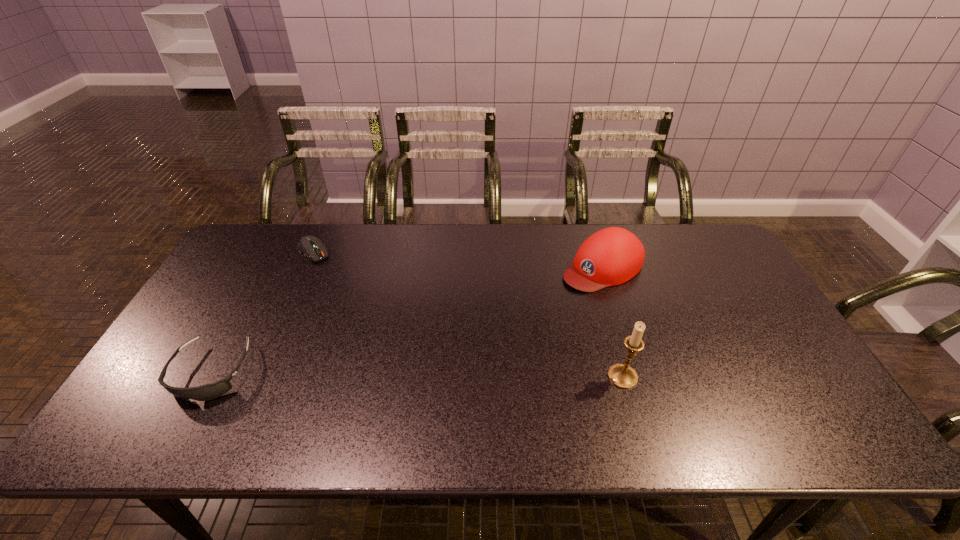
Identify the location of free spot between the third tallest object and the tallest object. (418, 374).

Locate an element on the screen. Image resolution: width=960 pixels, height=540 pixels. free space between the computer equipment and the second tallest object is located at coordinates (458, 259).

The width and height of the screenshot is (960, 540). What are the coordinates of `blank region between the shortest object and the tallest object` in the screenshot? It's located at (468, 314).

Image resolution: width=960 pixels, height=540 pixels. Identify the location of vacant space that is in between the tallest object and the baseball cap. (612, 322).

Locate an element on the screen. object that stands as the third closest to the tallest object is located at coordinates (310, 246).

Select which object appears as the closest to the tallest object. Please provide its 2D coordinates. Your answer should be formatted as a tuple, i.e. [(x, y)], where the tuple contains the x and y coordinates of a point satisfying the conditions above.

[(612, 256)]

Identify the location of free space that satisfies the following two spatial constraints: 1. on the lenses of the tallest object; 2. on the left side of the third tallest object. The width and height of the screenshot is (960, 540). (209, 376).

Find the location of a particular element. The image size is (960, 540). vacant area that satisfies the following two spatial constraints: 1. on the lenses of the goggles; 2. on the right side of the candle holder is located at coordinates (209, 376).

The image size is (960, 540). In order to click on blank space that satisfies the following two spatial constraints: 1. on the lenses of the candle holder; 2. on the right side of the second shortest object in this screenshot , I will do `click(209, 376)`.

The height and width of the screenshot is (540, 960). I want to click on vacant area that satisfies the following two spatial constraints: 1. on the back side of the third shortest object; 2. on the right side of the tallest object, so click(591, 267).